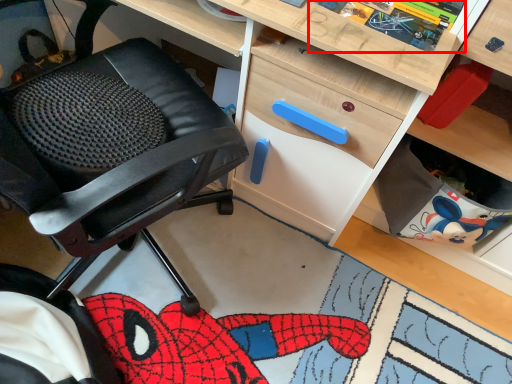
Question: From the image's perspective, considering the relative positions of comic book (annotated by the red box) and chair in the image provided, where is comic book (annotated by the red box) located with respect to the staircase?

Choices:
 (A) below
 (B) above

Answer: (B)